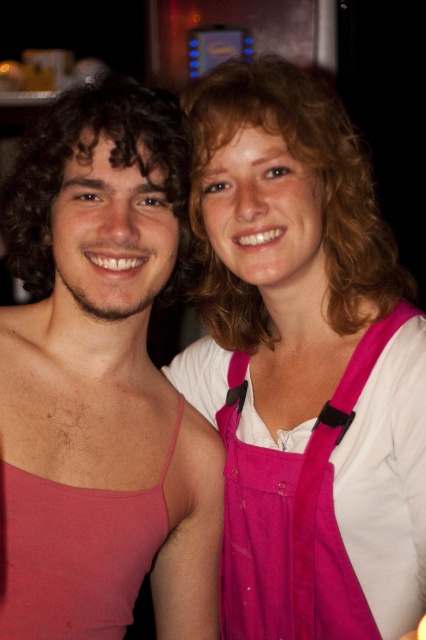
Can you confirm if pink fabric dress at center is wider than pink fabric apron at center?

Yes, pink fabric dress at center is wider than pink fabric apron at center.

Does point (230, 61) come closer to viewer compared to point (262, 561)?

Yes, point (230, 61) is in front of point (262, 561).

Find the location of `pink fabric dress at center`. pink fabric dress at center is located at coordinates (304, 364).

Does pink fabric dress at center have a lesser height compared to pink matte tank top at center?

No.

Who is lower down, pink fabric dress at center or pink matte tank top at center?

pink matte tank top at center

Is point (264, 330) farther from camera compared to point (143, 100)?

Yes, it is.

The height and width of the screenshot is (640, 426). What are the coordinates of `pink fabric dress at center` in the screenshot? It's located at (304, 364).

Between pink matte tank top at center and pink fabric apron at center, which one has more height?

With more height is pink matte tank top at center.

Find the location of a particular element. The height and width of the screenshot is (640, 426). pink matte tank top at center is located at coordinates (100, 381).